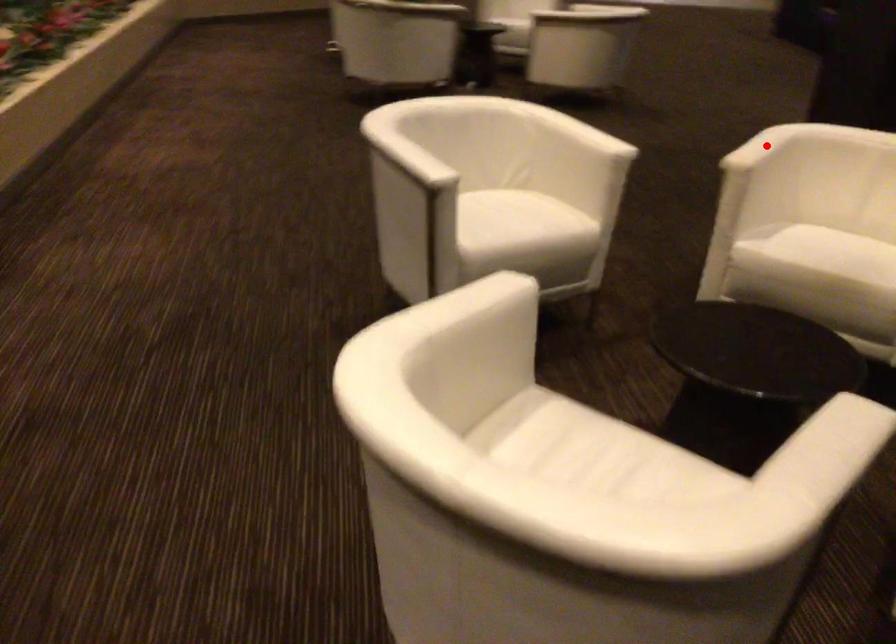
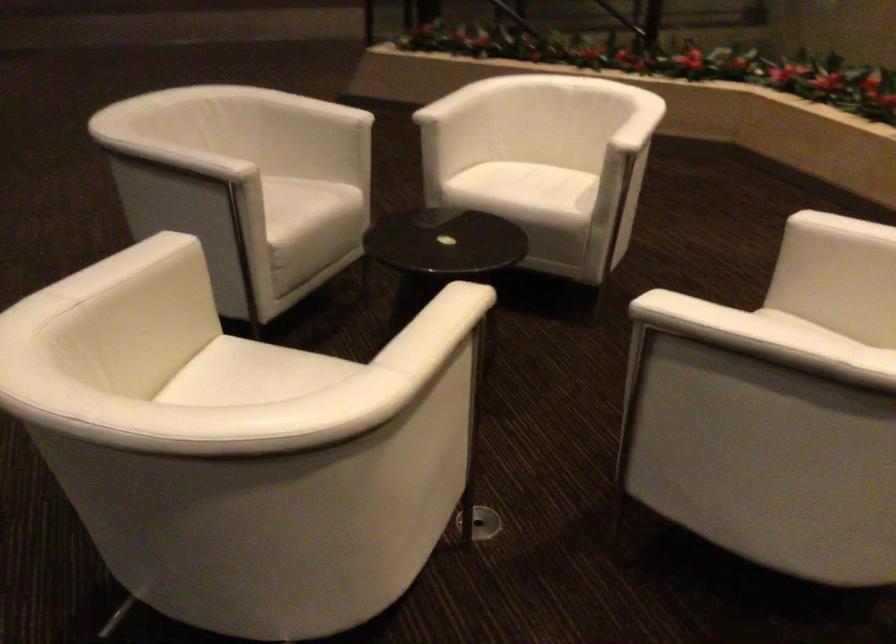
Question: I am providing you with two images of the same scene from different viewpoints. Image1 has a red point marked. In image2, the corresponding 3D location appears at what relative position? Reply with the corresponding letter.

Choices:
 (A) Closer
 (B) Farther

Answer: (A)